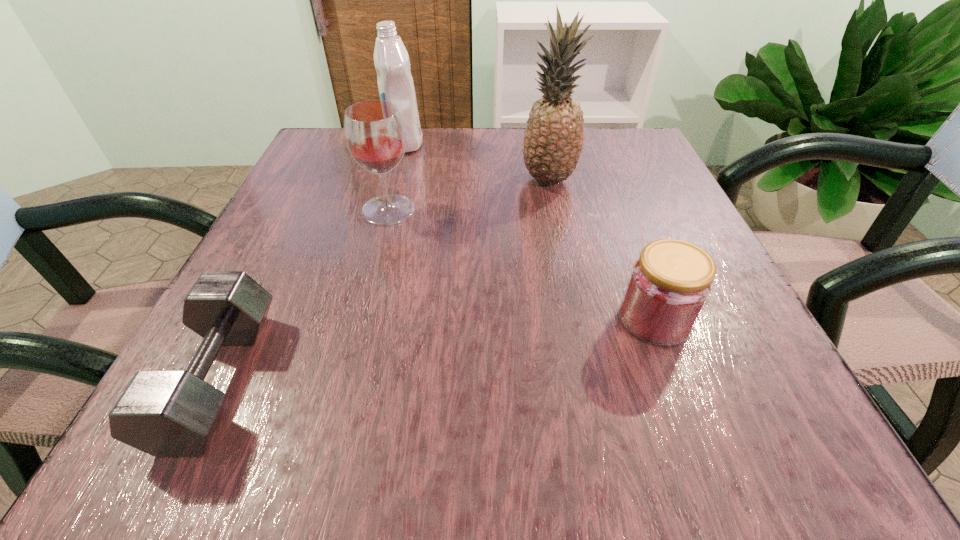
Locate an element on the screen. Image resolution: width=960 pixels, height=540 pixels. free space located on the right of the second object from right to left is located at coordinates (601, 179).

Identify the location of free space located 0.360m on the front of the fourth shortest object. This screenshot has width=960, height=540. (372, 268).

The width and height of the screenshot is (960, 540). I want to click on free space located 0.150m on the back of the third tallest object, so click(x=402, y=157).

At what (x,y) coordinates should I click in order to perform the action: click on vacant space located 0.160m on the left of the rightmost object. Please return your answer as a coordinate pair (x, y). The width and height of the screenshot is (960, 540). Looking at the image, I should click on (507, 319).

Identify the location of vacant space located on the back of the shortest object. (299, 217).

Identify the location of pineapple located at the far edge. (553, 142).

Where is `detergent that is at the far edge`? The width and height of the screenshot is (960, 540). detergent that is at the far edge is located at coordinates (395, 83).

The height and width of the screenshot is (540, 960). Find the location of `object that is at the near edge`. object that is at the near edge is located at coordinates (163, 413).

The width and height of the screenshot is (960, 540). I want to click on detergent situated at the left edge, so click(x=395, y=83).

Locate an element on the screen. The image size is (960, 540). wineglass situated at the left edge is located at coordinates (374, 131).